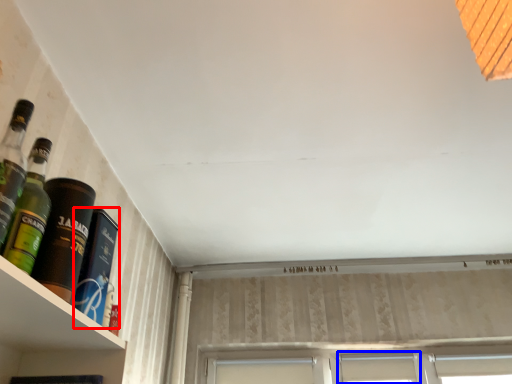
Question: Which object appears closest to the camera in this image, bottle (highlighted by a red box) or window (highlighted by a blue box)?

Choices:
 (A) bottle
 (B) window

Answer: (A)